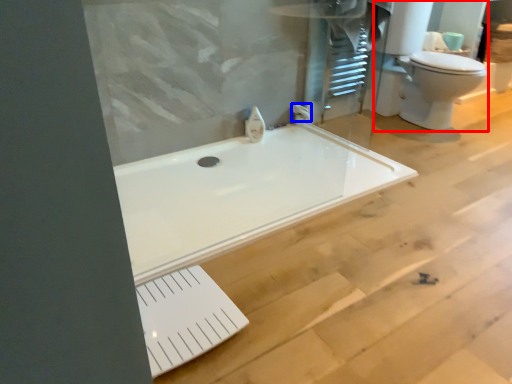
Question: Which point is further to the camera, sink (highlighted by a red box) or faucet (highlighted by a blue box)?

Choices:
 (A) sink
 (B) faucet

Answer: (B)